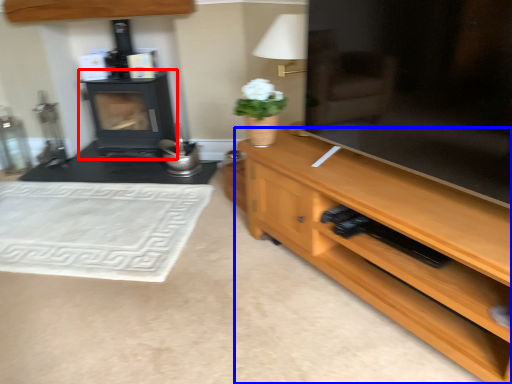
Question: Which of the following is the farthest to the observer, wood burning stove (highlighted by a red box) or desk (highlighted by a blue box)?

Choices:
 (A) wood burning stove
 (B) desk

Answer: (A)